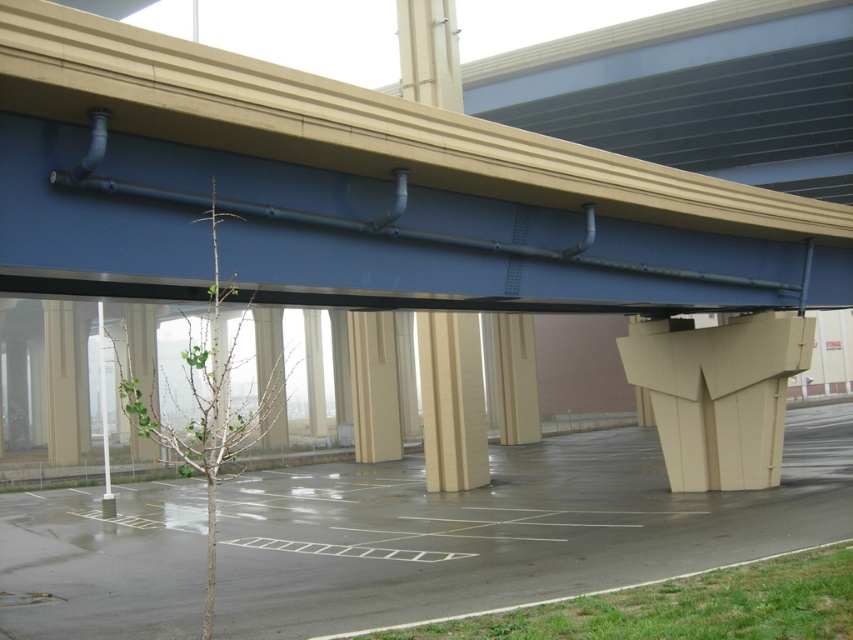
You are a city planner assessing the space. Given the smooth concrete overpass at center and the smooth asphalt parking lot at center, which one occupies a larger area in the scene?

The smooth asphalt parking lot at center occupies a larger area than the smooth concrete overpass at center.

You are standing at the point labeled point (355, 193) in the image. What type of structure are you under?

The point (355, 193) corresponds to the smooth concrete overpass at center, so you are under the smooth concrete overpass at center.

You are a delivery driver who needs to park your truck in the smooth asphalt parking lot at center. However, there is a smooth concrete overpass at center blocking the entrance. Which direction should you move to avoid the overpass and enter the parking lot?

The smooth concrete overpass at center is to the left of the smooth asphalt parking lot at center. To avoid the overpass, you should move to the right side of the parking lot entrance.